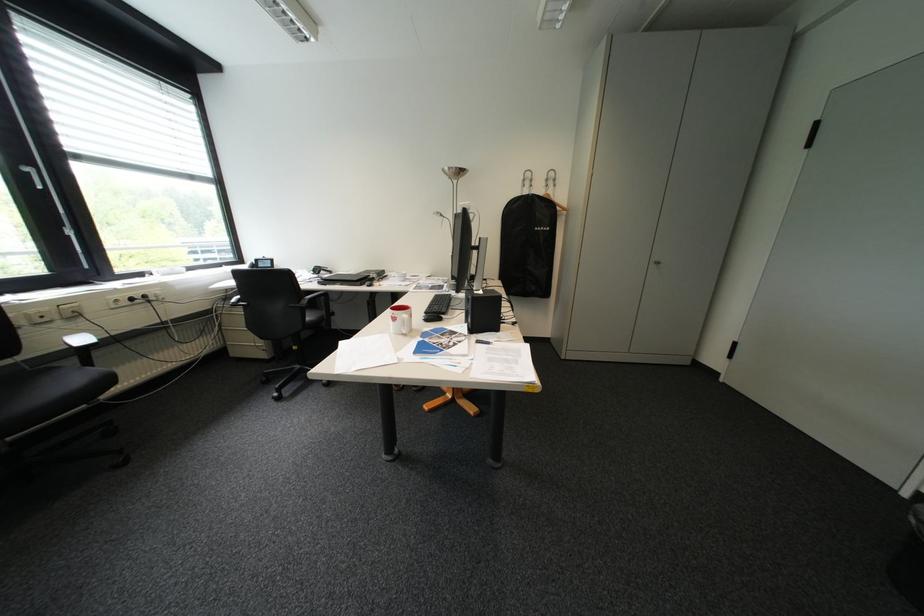
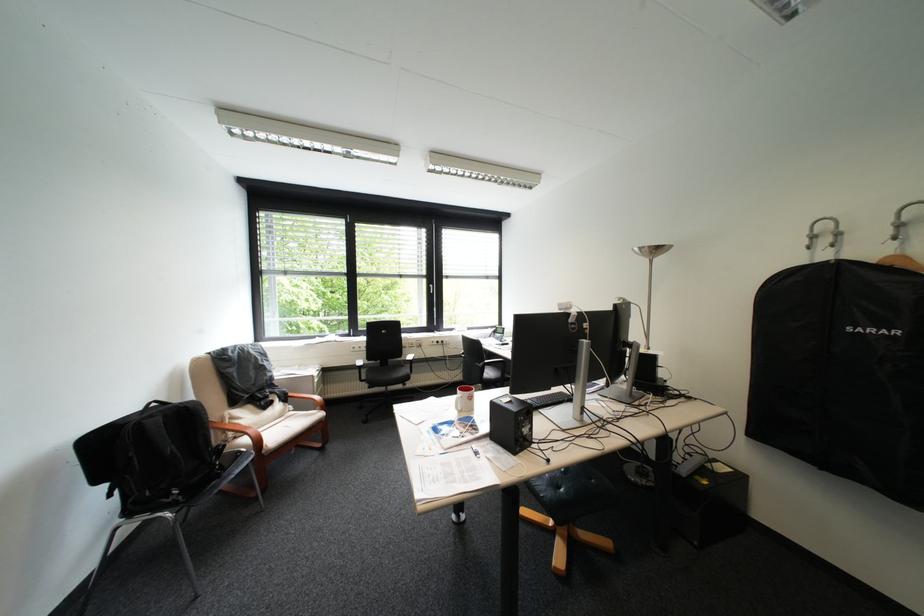
Where in the second image is the point corresponding to (x=553, y=229) from the first image?

(883, 331)